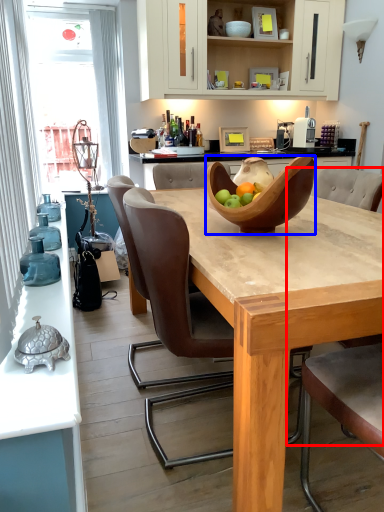
Question: Which of the following is the closest to the observer, armchair (highlighted by a red box) or bowl (highlighted by a blue box)?

Choices:
 (A) armchair
 (B) bowl

Answer: (A)